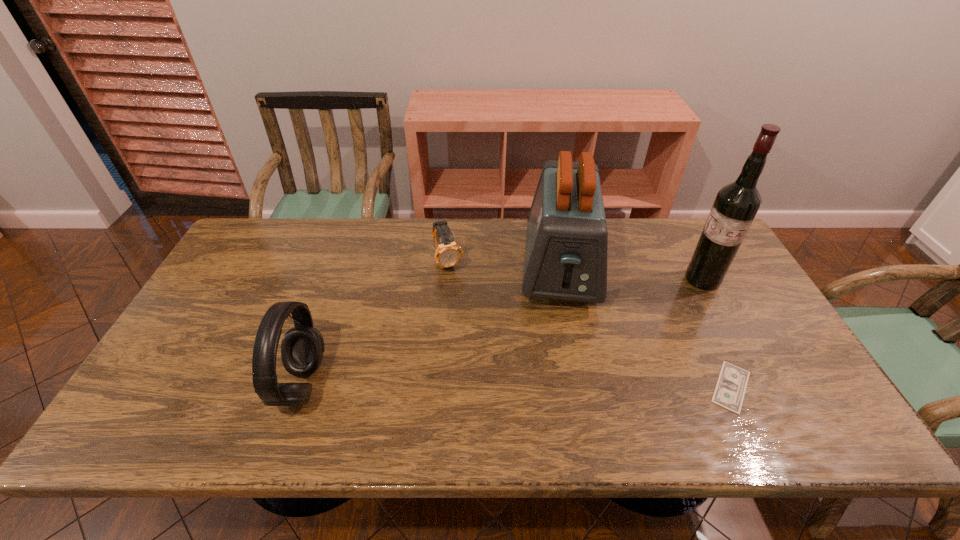
This screenshot has height=540, width=960. Identify the location of vacant spot on the desktop that is between the third shortest object and the shortest object and is positioned on the face of the second object from left to right. (503, 386).

This screenshot has height=540, width=960. Find the location of `vacant space on the desktop that is between the third tallest object and the money and is positioned on the front-facing side of the third object from right to left`. vacant space on the desktop that is between the third tallest object and the money and is positioned on the front-facing side of the third object from right to left is located at coordinates (563, 386).

You are a GUI agent. You are given a task and a screenshot of the screen. Output one action in this format:
    pyautogui.click(x=<x>, y=<y>)
    Task: Click on the free space on the desktop that is between the headset and the shortest object and is positioned on the front and back of the wine bottle
    
    Given the screenshot: What is the action you would take?
    pyautogui.click(x=564, y=386)